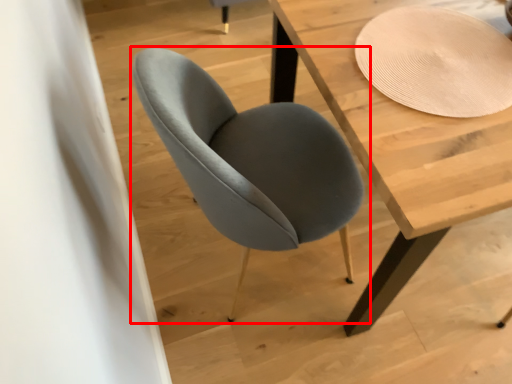
Question: From the image's perspective, where is chair (annotated by the red box) located relative to table?

Choices:
 (A) below
 (B) above

Answer: (A)